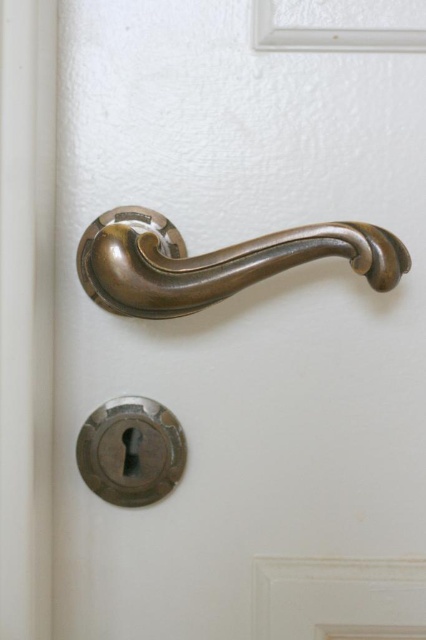
You are trying to locate two specific points on the door handle area. The first point is at coordinates point [305,228] and the second is at point [92,461]. From your perspective standing in front of the door, which point is closer to you?

Point [305,228] is in front of point [92,461], so it is closer to you.

You are a maintenance worker holding a 50 cm long tool. You need to reach the bronze polished door handle at center to clean it. Can you reach the handle without moving closer?

The bronze polished door handle at center is 51.68 centimeters away from the viewer. Since the tool is 50 cm long, you cannot reach it without moving closer.